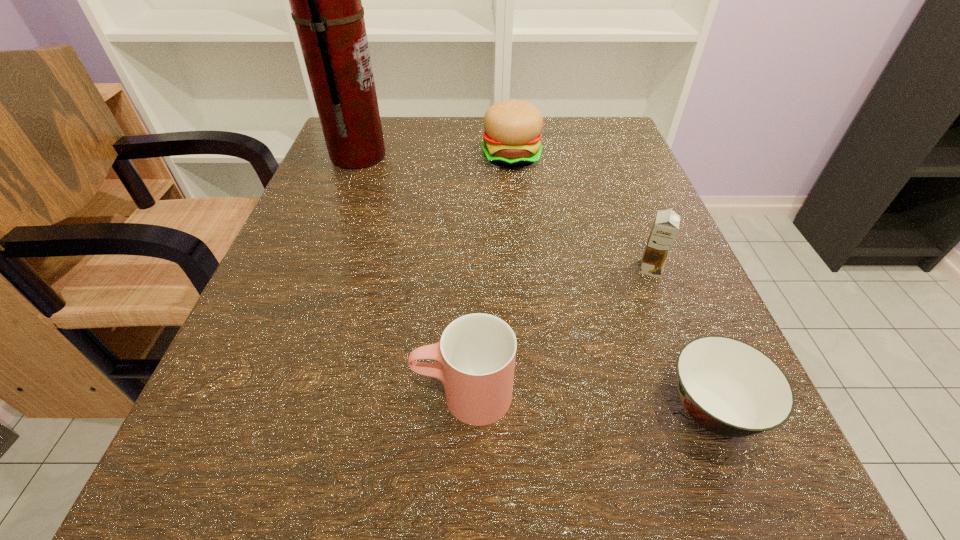
Identify the location of vacant space that satisfies the following two spatial constraints: 1. on the side of the cup with the handle; 2. on the back side of the chocolate milk. (467, 269).

Find the location of a particular element. Image resolution: width=960 pixels, height=540 pixels. vacant space that satisfies the following two spatial constraints: 1. on the side of the fire extinguisher with the handle and hose; 2. on the back side of the soup bowl is located at coordinates (262, 409).

Where is `free space that satisfies the following two spatial constraints: 1. on the front side of the hamburger; 2. on the left side of the third nearest object`? The width and height of the screenshot is (960, 540). free space that satisfies the following two spatial constraints: 1. on the front side of the hamburger; 2. on the left side of the third nearest object is located at coordinates (522, 269).

The image size is (960, 540). What are the coordinates of `free space that satisfies the following two spatial constraints: 1. on the side of the leftmost object with the handle and hose; 2. on the right side of the hamburger` in the screenshot? It's located at (358, 157).

Locate an element on the screen. The image size is (960, 540). vacant region that satisfies the following two spatial constraints: 1. on the side of the chocolate milk with the handle and hose; 2. on the left side of the leftmost object is located at coordinates (315, 269).

Where is `vacant region that satisfies the following two spatial constraints: 1. on the side of the chocolate milk with the handle; 2. on the right side of the cup`? The image size is (960, 540). vacant region that satisfies the following two spatial constraints: 1. on the side of the chocolate milk with the handle; 2. on the right side of the cup is located at coordinates (467, 269).